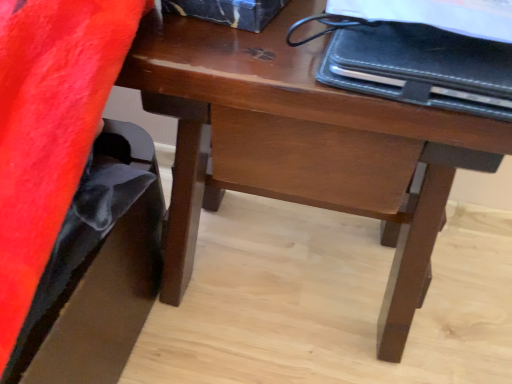
Question: From their relative heights in the image, would you say wooden desk at center is taller or shorter than black leather notebook at upper right?

Choices:
 (A) short
 (B) tall

Answer: (B)

Question: Is wooden desk at center inside the boundaries of black leather notebook at upper right, or outside?

Choices:
 (A) outside
 (B) inside

Answer: (A)

Question: Looking at their shapes, would you say wooden desk at center is wider or thinner than black leather notebook at upper right?

Choices:
 (A) wide
 (B) thin

Answer: (A)

Question: In the image, is black leather notebook at upper right positioned in front of or behind wooden desk at center?

Choices:
 (A) front
 (B) behind

Answer: (A)

Question: In terms of height, does black leather notebook at upper right look taller or shorter compared to wooden desk at center?

Choices:
 (A) tall
 (B) short

Answer: (B)

Question: Based on their sizes in the image, would you say black leather notebook at upper right is bigger or smaller than wooden desk at center?

Choices:
 (A) small
 (B) big

Answer: (A)

Question: Is black leather notebook at upper right situated inside wooden desk at center or outside?

Choices:
 (A) inside
 (B) outside

Answer: (B)